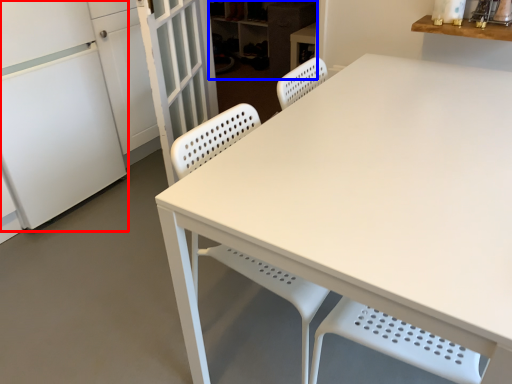
Question: Which point is further to the camera, fridge (highlighted by a red box) or cabinetry (highlighted by a blue box)?

Choices:
 (A) fridge
 (B) cabinetry

Answer: (B)